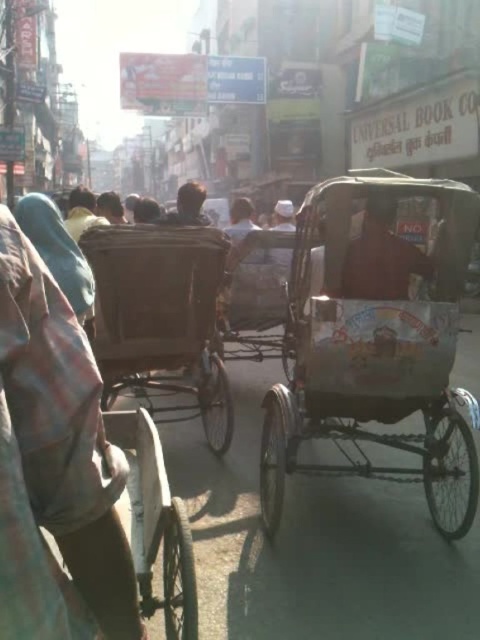
You are a pedestrian standing on the street and want to cross to the other side. There is a white painted wood rickshaw at center and a wooden cart at center in your path. Which object should you move around first?

You should move around the white painted wood rickshaw at center first since it is in front of the wooden cart at center and closer to you.

You are standing at the camera position and want to reach the point marked at coordinates (311, 227). Considering the scene described, is this point within the immediate vicinity of the occupied rickshaw in the foreground?

The point marked at coordinates (311, 227) is 3.21 meters away from the camera, which places it within the immediate vicinity of the occupied rickshaw in the foreground since it is relatively close.

You are standing on the street and want to take a photo of the white painted wood rickshaw at center. If your camera can focus on objects up to 3 meters away, will you need to move closer to take a clear picture?

The white painted wood rickshaw at center is 2.48 meters from viewer, which is within the camera focus range of up to 3 meters. Therefore, you do not need to move closer to take a clear picture.